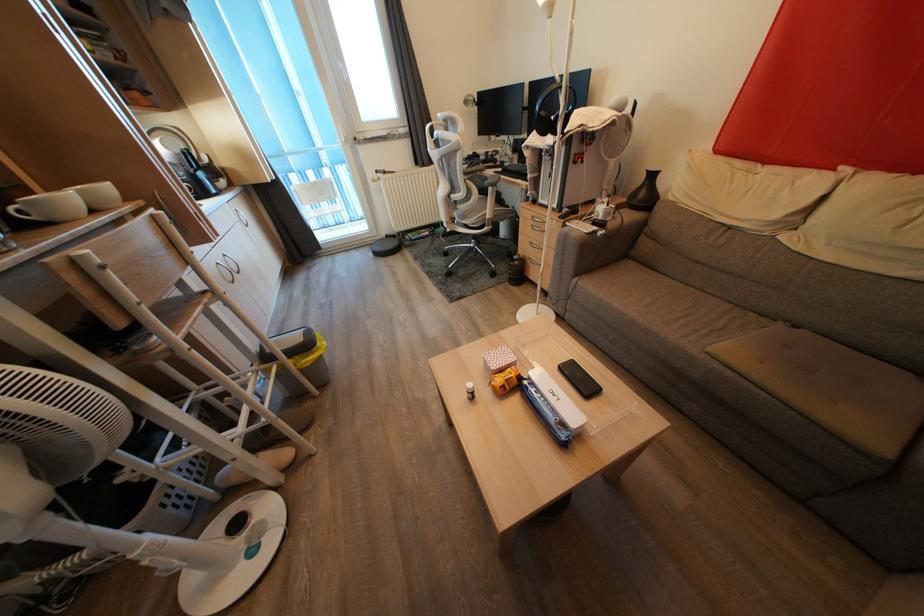
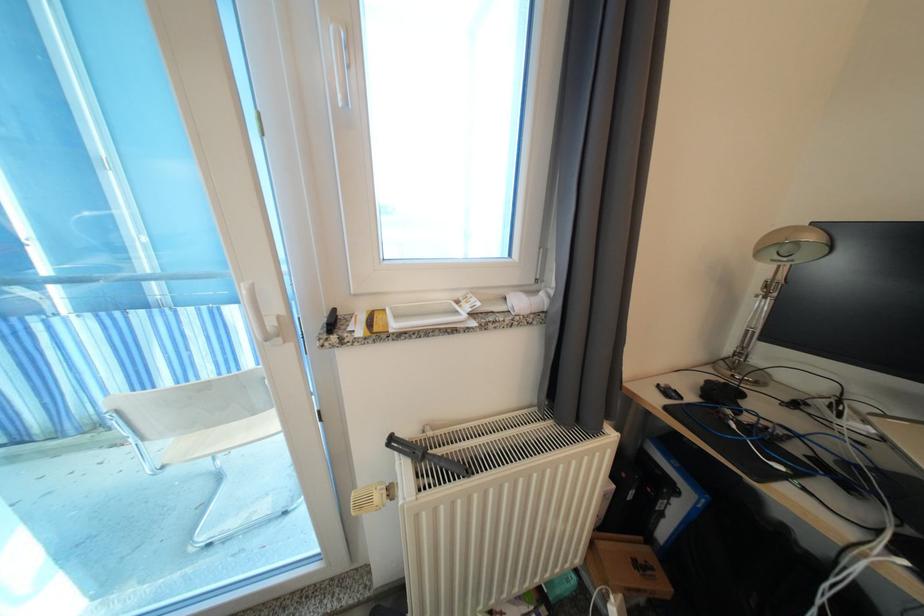
Locate, in the second image, the point that corresponds to the point at 382,176 in the first image.

(395, 445)